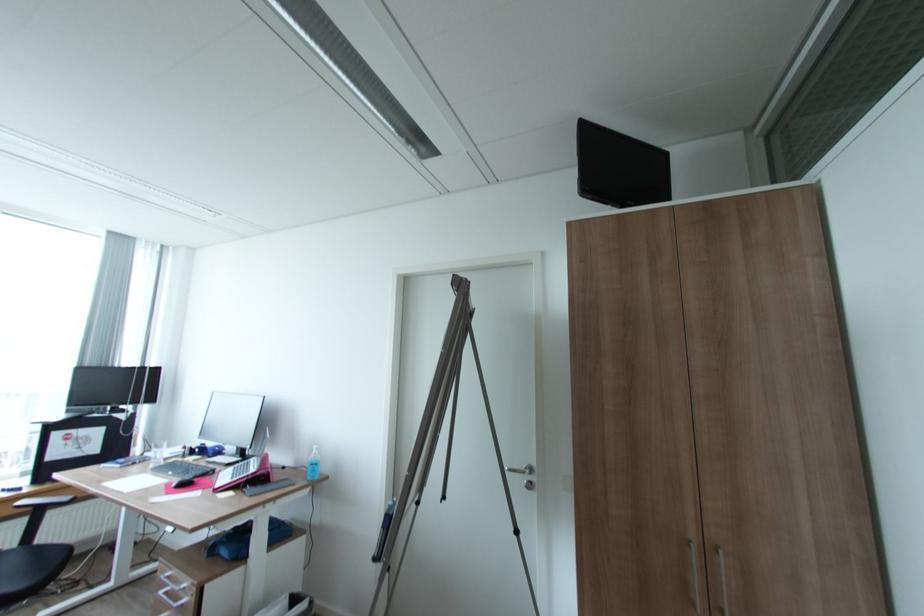
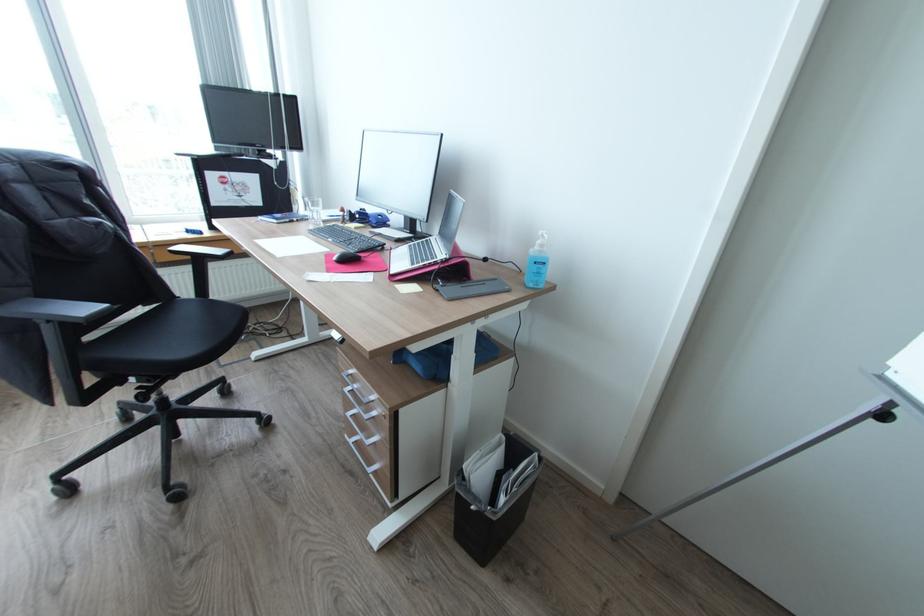
Find the pixel in the second image that matches (x=174, y=493) in the first image.

(334, 270)